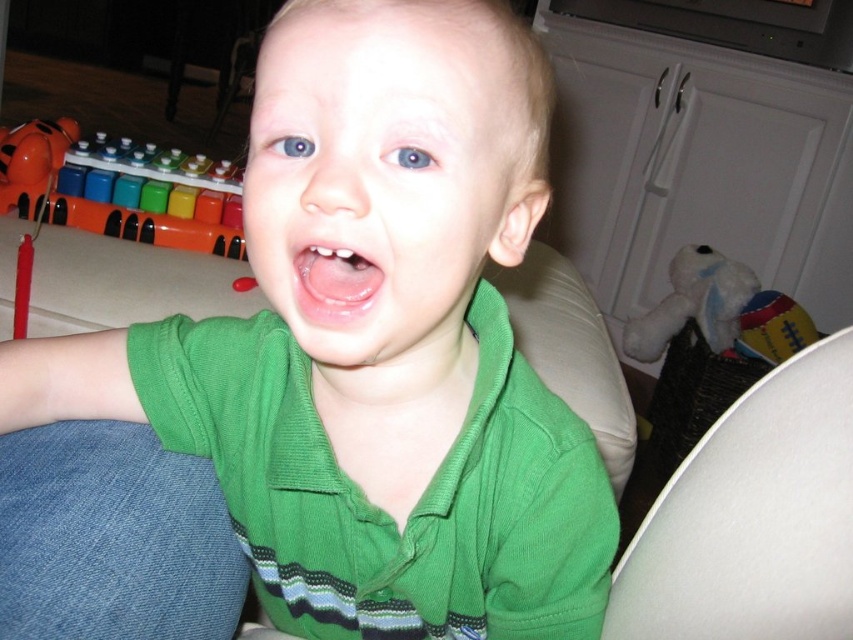
Question: Is the position of green cotton shirt at center less distant than that of blue matte eye at upper center?

Choices:
 (A) yes
 (B) no

Answer: (A)

Question: Among these points, which one is farthest from the camera?

Choices:
 (A) (334, 17)
 (B) (308, 266)

Answer: (B)

Question: Is green matte shirt at center smaller than white plush bear at right?

Choices:
 (A) no
 (B) yes

Answer: (B)

Question: Observing the image, what is the correct spatial positioning of green cotton shirt at center in reference to rubber xylophone at left?

Choices:
 (A) right
 (B) left

Answer: (A)

Question: Which of the following is the farthest from the observer?

Choices:
 (A) green matte shirt at center
 (B) green cotton shirt at center

Answer: (B)

Question: Which point is closer to the camera?

Choices:
 (A) (345, 339)
 (B) (299, 289)
 (C) (717, 316)
 (D) (276, 150)

Answer: (A)